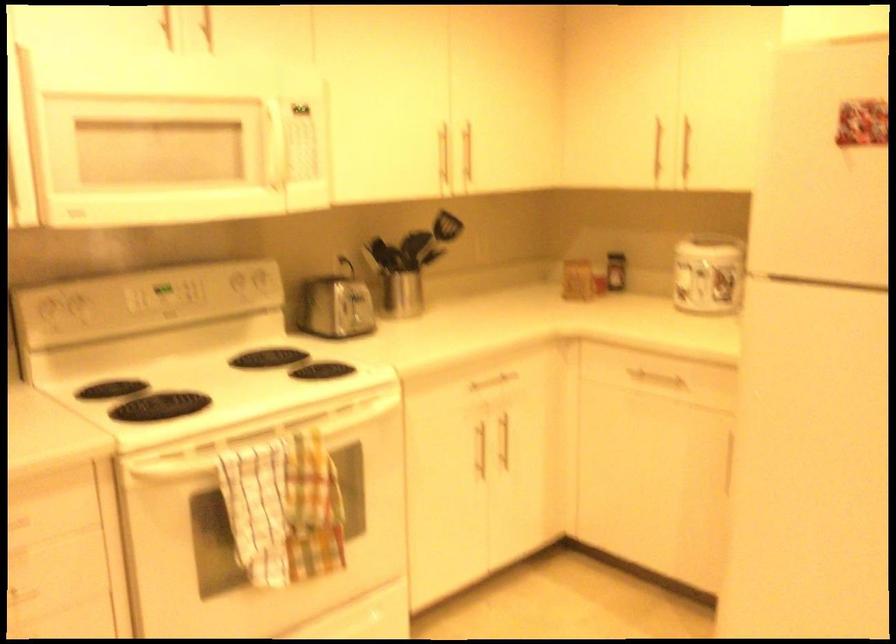
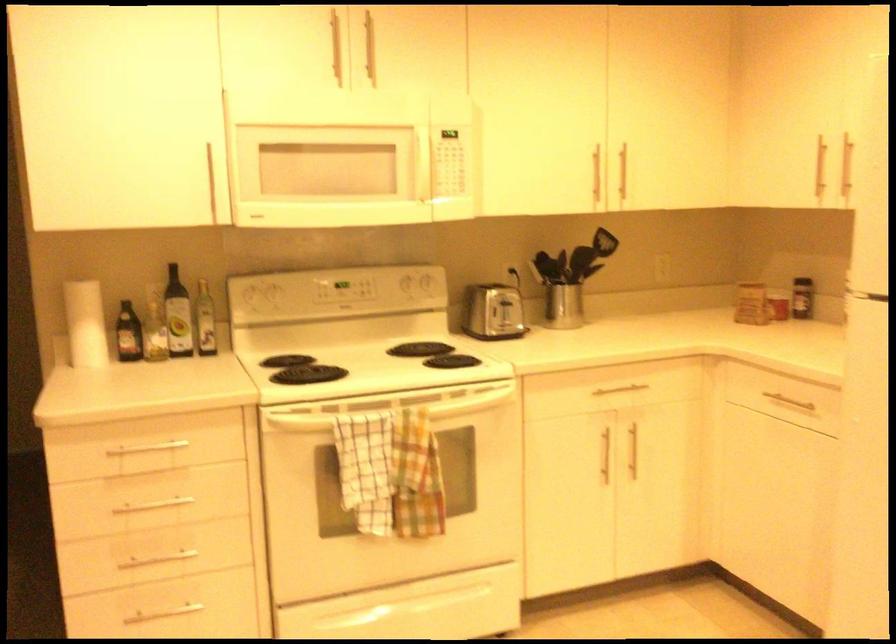
The point at (197, 379) is marked in the first image. Where is the corresponding point in the second image?

(364, 363)